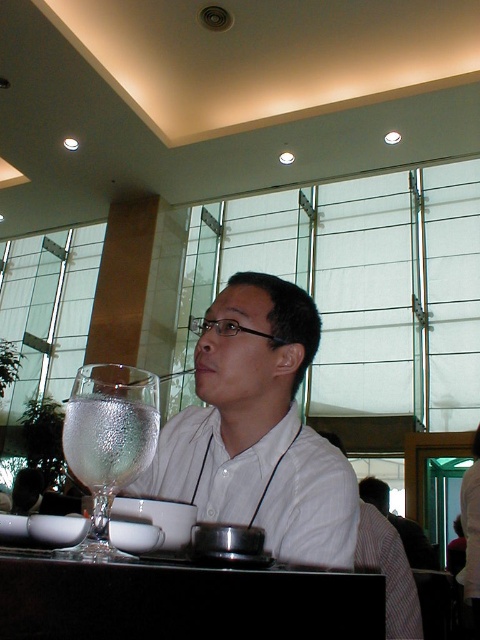
You are a server in a restaurant and need to place a new menu on the table. The menu is the same size as the clear glass wine glass at left. Will the black glossy table at lower center be able to accommodate the menu without it hanging off the edge?

The black glossy table at lower center is bigger than the clear glass wine glass at left, so the menu, being the same size as the glass, should fit comfortably on the table without hanging off the edge.

You are a waiter in a restaurant and need to place a new order of a salad plate in front of the customer. The salad plate is 20 cm in diameter. The black glossy table at lower center and the clear glass wine glass at left are already on the table. Can you place the salad plate between them without moving the existing items?

The black glossy table at lower center is positioned on the right side of the clear glass wine glass at left. Since the salad plate is 20 cm in diameter, you need to ensure there is enough space between them. However, the description does not provide the distance between the two items, so it is uncertain if the salad plate will fit without moving existing items.